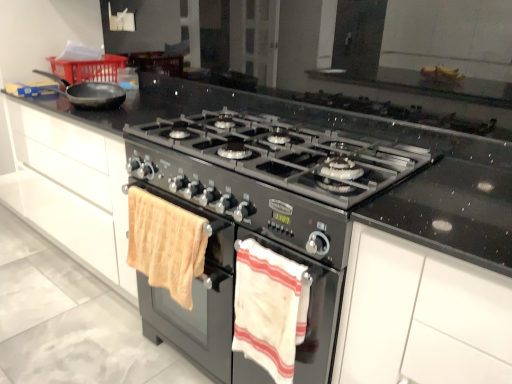
Question: Does white striped towel at lower center, the first beach towel when ordered from right to left, have a greater width compared to black matte gas stove at center?

Choices:
 (A) no
 (B) yes

Answer: (A)

Question: Is white striped towel at lower center, the 2th beach towel when ordered from left to right, at the right side of black matte gas stove at center?

Choices:
 (A) yes
 (B) no

Answer: (B)

Question: Is white striped towel at lower center, the 2th beach towel when ordered from left to right, smaller than black matte gas stove at center?

Choices:
 (A) yes
 (B) no

Answer: (A)

Question: Is white striped towel at lower center, the first beach towel when ordered from right to left, far away from black matte gas stove at center?

Choices:
 (A) yes
 (B) no

Answer: (B)

Question: From a real-world perspective, is white striped towel at lower center, the 2th beach towel when ordered from left to right, over black matte gas stove at center?

Choices:
 (A) yes
 (B) no

Answer: (B)

Question: Is black matte frying pan at upper left to the left or to the right of black matte gas stove at center in the image?

Choices:
 (A) right
 (B) left

Answer: (B)

Question: From the image's perspective, is black matte frying pan at upper left positioned above or below black matte gas stove at center?

Choices:
 (A) above
 (B) below

Answer: (A)

Question: Based on their sizes in the image, would you say black matte frying pan at upper left is bigger or smaller than black matte gas stove at center?

Choices:
 (A) big
 (B) small

Answer: (B)

Question: Is black matte frying pan at upper left inside or outside of black matte gas stove at center?

Choices:
 (A) outside
 (B) inside

Answer: (A)

Question: From a real-world perspective, is white matte cabinet at upper right above or below black matte frying pan at upper left?

Choices:
 (A) above
 (B) below

Answer: (B)

Question: Considering the relative positions of white matte cabinet at upper right and black matte frying pan at upper left in the image provided, is white matte cabinet at upper right to the left or to the right of black matte frying pan at upper left?

Choices:
 (A) right
 (B) left

Answer: (A)

Question: Considering the positions of white matte cabinet at upper right and black matte frying pan at upper left in the image, is white matte cabinet at upper right wider or thinner than black matte frying pan at upper left?

Choices:
 (A) thin
 (B) wide

Answer: (B)

Question: From the image's perspective, is white matte cabinet at upper right positioned above or below black matte frying pan at upper left?

Choices:
 (A) below
 (B) above

Answer: (A)

Question: Based on their sizes in the image, would you say white striped towel at lower center, the 2th beach towel when ordered from left to right, is bigger or smaller than beige cotton towel at lower left, positioned as the second beach towel in right-to-left order?

Choices:
 (A) big
 (B) small

Answer: (B)

Question: Considering the positions of white striped towel at lower center, the 2th beach towel when ordered from left to right, and beige cotton towel at lower left, marked as the 1th beach towel in a left-to-right arrangement, in the image, is white striped towel at lower center, the 2th beach towel when ordered from left to right, wider or thinner than beige cotton towel at lower left, marked as the 1th beach towel in a left-to-right arrangement,?

Choices:
 (A) thin
 (B) wide

Answer: (A)